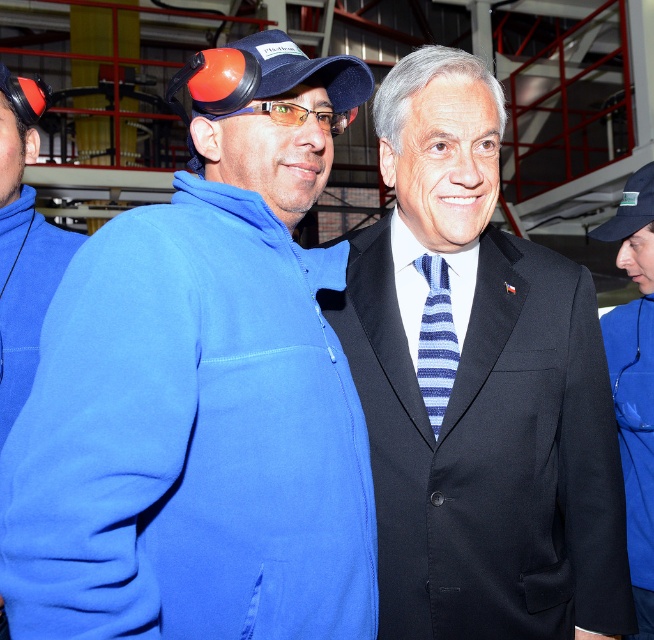
Is blue fleece jacket at center bigger than blue striped tie at center?

Correct, blue fleece jacket at center is larger in size than blue striped tie at center.

Image resolution: width=654 pixels, height=640 pixels. In order to click on blue fleece jacket at center in this screenshot , I will do `click(634, 380)`.

Does matte black suit at center have a smaller size compared to blue fleece jacket at center?

Incorrect, matte black suit at center is not smaller in size than blue fleece jacket at center.

In the scene shown: Who is positioned more to the left, matte black suit at center or blue fleece jacket at center?

Positioned to the left is matte black suit at center.

The height and width of the screenshot is (640, 654). Identify the location of matte black suit at center. (479, 388).

Does matte black suit at center have a lesser width compared to navy blue fabric cap at center?

No, matte black suit at center is not thinner than navy blue fabric cap at center.

Who is higher up, matte black suit at center or navy blue fabric cap at center?

navy blue fabric cap at center

The image size is (654, 640). What do you see at coordinates (479, 388) in the screenshot? I see `matte black suit at center` at bounding box center [479, 388].

Find the location of a particular element. matte black suit at center is located at coordinates [479, 388].